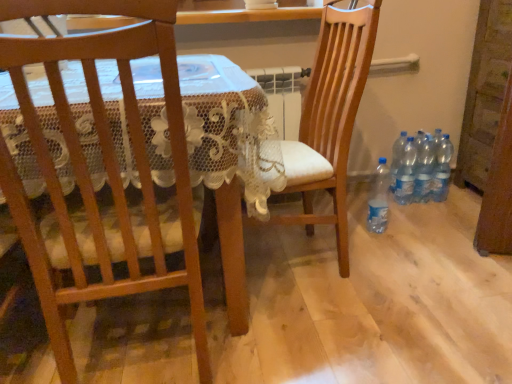
Locate an element on the screen. The width and height of the screenshot is (512, 384). free space in front of clear plastic bottles at lower right, the 5th bottle positioned from the left is located at coordinates (445, 215).